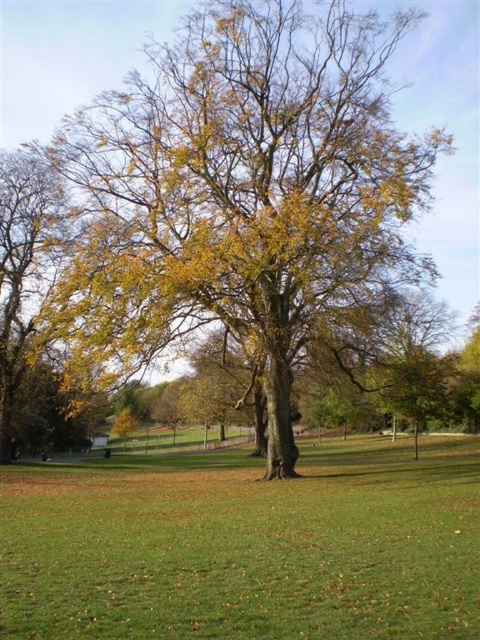
Question: Is yellow-green leafy oak tree at center further to the viewer compared to green grassy field at center?

Choices:
 (A) yes
 (B) no

Answer: (A)

Question: Which object appears farthest from the camera in this image?

Choices:
 (A) green grassy field at center
 (B) yellow-green leafy oak tree at center

Answer: (B)

Question: Among these objects, which one is farthest from the camera?

Choices:
 (A) green grassy field at center
 (B) yellow-green leafy oak tree at center

Answer: (B)

Question: Can you confirm if yellow-green leafy oak tree at center is bigger than green grassy field at center?

Choices:
 (A) no
 (B) yes

Answer: (B)

Question: Among these points, which one is farthest from the camera?

Choices:
 (A) (232, 16)
 (B) (83, 465)

Answer: (B)

Question: Is the position of yellow-green leafy oak tree at center more distant than that of green grassy field at center?

Choices:
 (A) yes
 (B) no

Answer: (A)